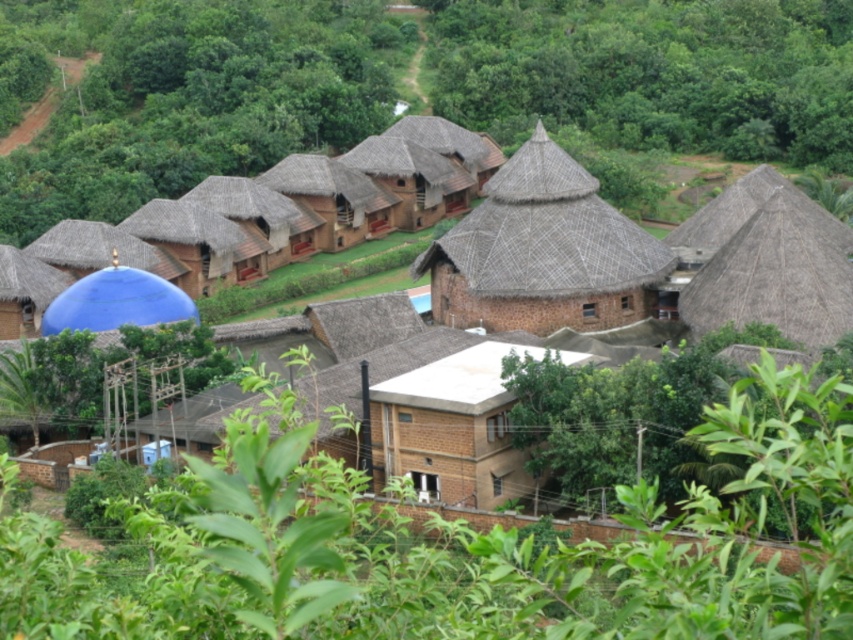
You are standing in front of the cluster of traditional buildings. You notice two points marked in the scene. Which of the two points, point (850, 621) or point (426, 250), is closer to you?

Point (850, 621) is closer to the viewer than point (426, 250).